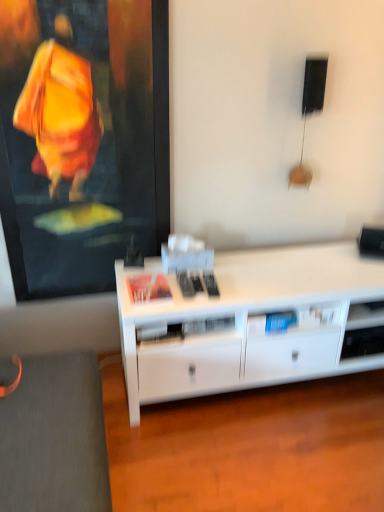
Question: Does textured fabric cushion at lower left appear on the right side of white matte desk at center?

Choices:
 (A) yes
 (B) no

Answer: (B)

Question: From a real-world perspective, is textured fabric cushion at lower left positioned over white matte desk at center based on gravity?

Choices:
 (A) no
 (B) yes

Answer: (A)

Question: From a real-world perspective, does textured fabric cushion at lower left sit lower than white matte desk at center?

Choices:
 (A) no
 (B) yes

Answer: (B)

Question: Can you confirm if textured fabric cushion at lower left is taller than white matte desk at center?

Choices:
 (A) yes
 (B) no

Answer: (B)

Question: Would you say white matte desk at center is part of textured fabric cushion at lower left's contents?

Choices:
 (A) yes
 (B) no

Answer: (B)

Question: Is textured fabric cushion at lower left beside white matte desk at center?

Choices:
 (A) yes
 (B) no

Answer: (B)

Question: Is white matte desk at center turned away from textured fabric cushion at lower left?

Choices:
 (A) no
 (B) yes

Answer: (A)

Question: Considering the relative sizes of white matte desk at center and textured fabric cushion at lower left in the image provided, is white matte desk at center taller than textured fabric cushion at lower left?

Choices:
 (A) no
 (B) yes

Answer: (B)

Question: Does white matte desk at center have a lesser height compared to textured fabric cushion at lower left?

Choices:
 (A) no
 (B) yes

Answer: (A)

Question: Does white matte desk at center have a larger size compared to textured fabric cushion at lower left?

Choices:
 (A) no
 (B) yes

Answer: (B)

Question: Does white matte desk at center have a lesser width compared to textured fabric cushion at lower left?

Choices:
 (A) yes
 (B) no

Answer: (A)

Question: From the image's perspective, would you say white matte desk at center is positioned over textured fabric cushion at lower left?

Choices:
 (A) yes
 (B) no

Answer: (A)

Question: From the image's perspective, is white matte desk at center located above or below textured fabric cushion at lower left?

Choices:
 (A) below
 (B) above

Answer: (B)